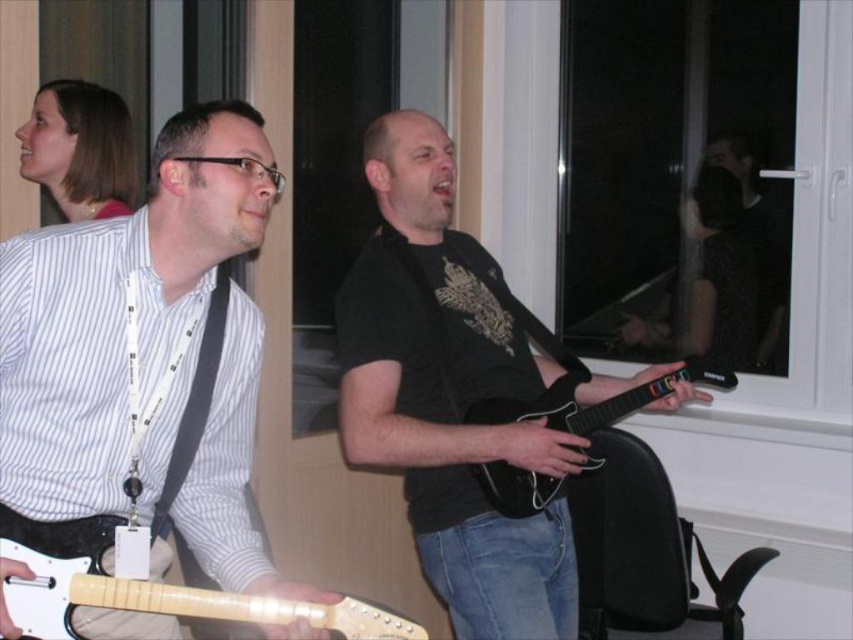
You are a game developer observing the scene. You need to place a new controller stand between the white glossy guitar at left and the black matte guitar at center. Based on their positions, where should the stand be placed?

The stand should be placed to the right of the white glossy guitar at left and to the left of the black matte guitar at center since the white glossy guitar at left is positioned to the left of the black matte guitar at center.

You are standing in the room and want to place a new speaker at the exact center of the black matte guitar at center. What are the coordinates where you should place the speaker?

The coordinates for the exact center of the black matte guitar at center are provided as point coordinates at (450, 396).